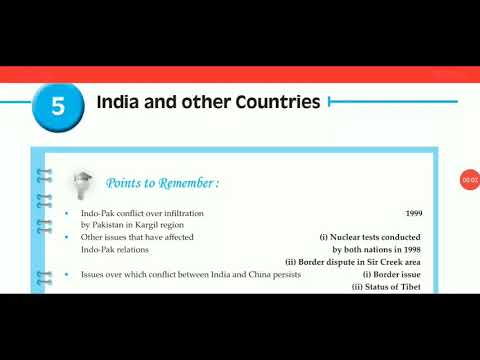
Find the location of `books`. books is located at coordinates (173, 243).